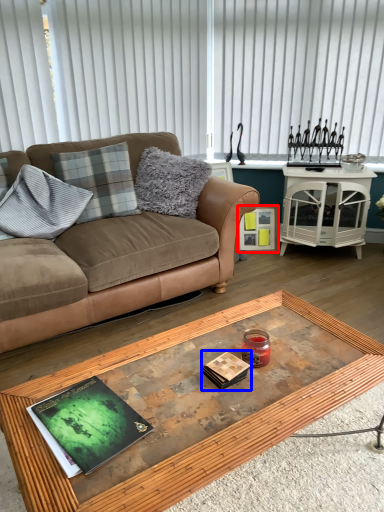
Question: Which of the following is the farthest to the observer, picture frame (highlighted by a red box) or magazine (highlighted by a blue box)?

Choices:
 (A) picture frame
 (B) magazine

Answer: (A)